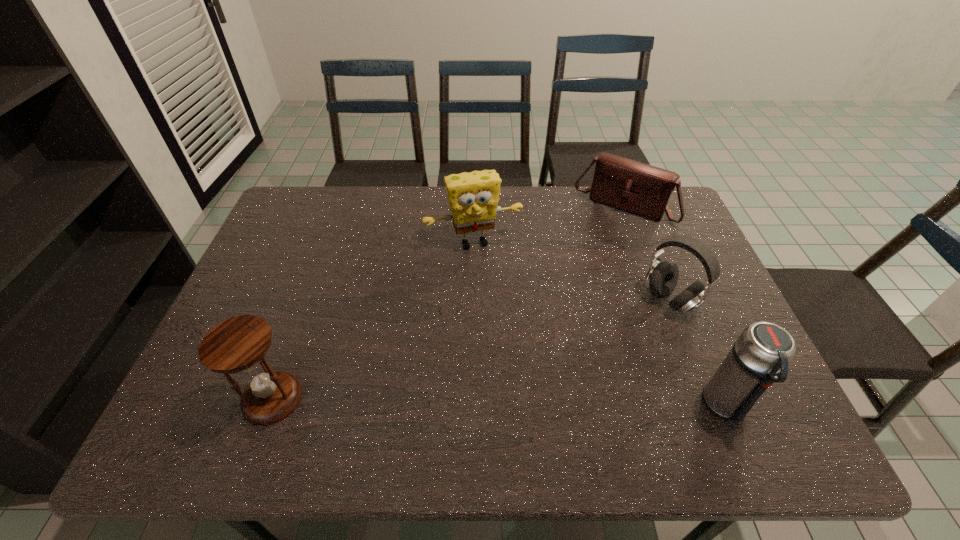
The height and width of the screenshot is (540, 960). Identify the location of empty location between the thermos bottle and the headset. (698, 353).

Image resolution: width=960 pixels, height=540 pixels. I want to click on unoccupied position between the shoulder bag and the second object from left to right, so click(x=548, y=225).

What are the coordinates of `free space between the sponge and the shortest object` in the screenshot? It's located at (548, 225).

Where is `free space between the headset and the shoulder bag`? The width and height of the screenshot is (960, 540). free space between the headset and the shoulder bag is located at coordinates (646, 254).

This screenshot has width=960, height=540. Find the location of `vacant region between the thermos bottle and the third nearest object`. vacant region between the thermos bottle and the third nearest object is located at coordinates (698, 353).

Image resolution: width=960 pixels, height=540 pixels. Find the location of `vacant area between the thermos bottle and the hourglass`. vacant area between the thermos bottle and the hourglass is located at coordinates (499, 402).

This screenshot has width=960, height=540. Find the location of `free spot between the shoulder bag and the third nearest object`. free spot between the shoulder bag and the third nearest object is located at coordinates (646, 254).

At what (x,y) coordinates should I click in order to perform the action: click on vacant area that lies between the headset and the fourth object from right to left. Please return your answer as a coordinate pair (x, y). This screenshot has height=540, width=960. Looking at the image, I should click on (571, 271).

The height and width of the screenshot is (540, 960). Identify the location of blank region between the hourglass and the thermos bottle. (499, 402).

Find the location of `object that is the third closest to the shortest object`. object that is the third closest to the shortest object is located at coordinates (760, 356).